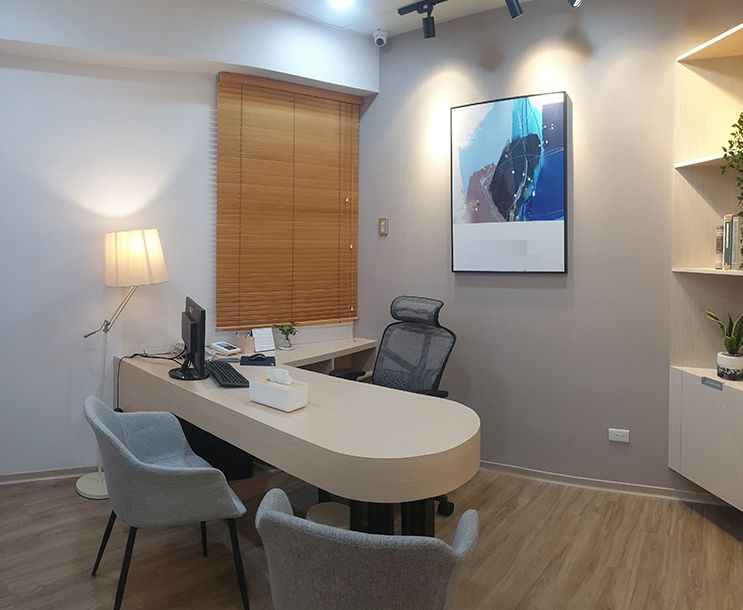
This screenshot has width=743, height=610. In order to click on tissues in this screenshot , I will do `click(282, 378)`.